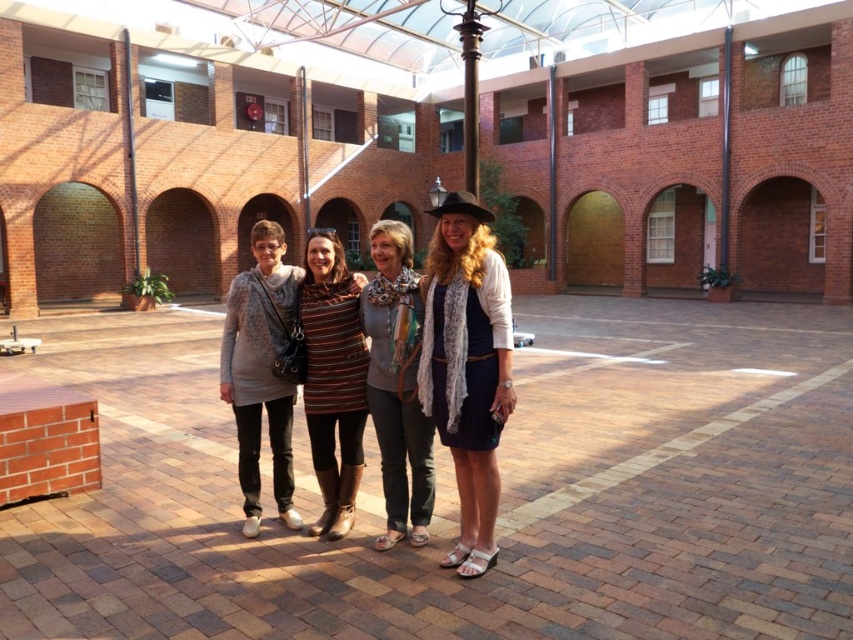
What do you see at coordinates (467, 365) in the screenshot? This screenshot has width=853, height=640. I see `white lace dress at center` at bounding box center [467, 365].

Is point (465, 470) positioned after point (416, 365)?

No, it is not.

I want to click on white lace dress at center, so click(x=467, y=365).

In the scene shown: Does gray knit sweater at center have a larger size compared to striped fabric dress at center?

Correct, gray knit sweater at center is larger in size than striped fabric dress at center.

Between gray knit sweater at center and striped fabric dress at center, which one appears on the left side from the viewer's perspective?

Positioned to the left is striped fabric dress at center.

Between point (370, 300) and point (318, 465), which one is positioned in front?

Point (370, 300)

Locate an element on the screen. The height and width of the screenshot is (640, 853). gray knit sweater at center is located at coordinates (397, 385).

Describe the element at coordinates (467, 365) in the screenshot. This screenshot has width=853, height=640. I see `white lace dress at center` at that location.

Measure the distance between white lace dress at center and camera.

10.55 feet

Who is more forward, (497, 484) or (309, 531)?

Positioned in front is point (497, 484).

Find the location of `white lace dress at center`. white lace dress at center is located at coordinates (467, 365).